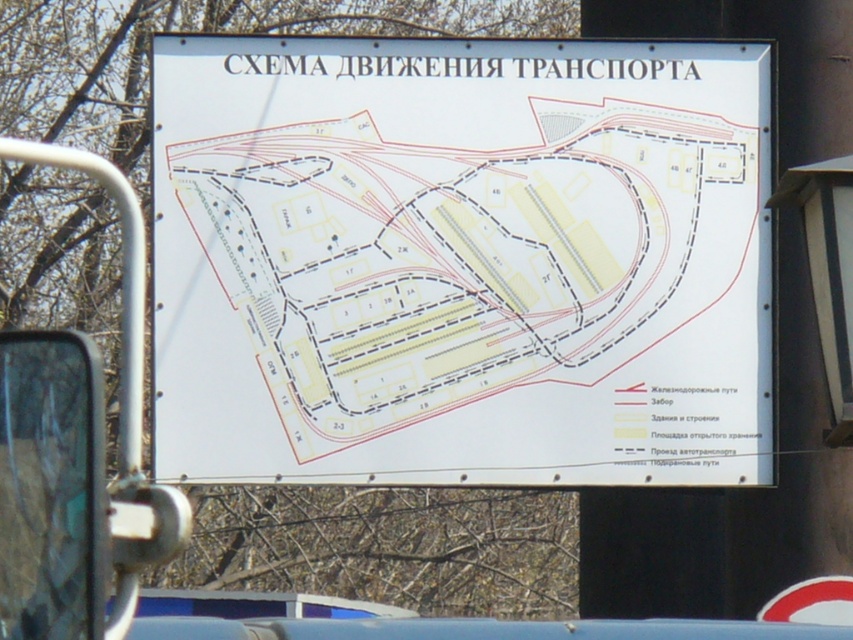
You are a traveler at the station looking at the signboard. Which of the two signs, the white paper sign at center or the white plastic sign at upper center, is shorter?

The white paper sign at center is shorter than the white plastic sign at upper center.

You are a traveler at the railway station looking at the signboard. You notice two signs on the board. Which one is closer to you, the white paper sign at center or the white plastic sign at upper center?

The white paper sign at center is closer to you because it is in front of the white plastic sign at upper center.

You are standing in front of the signboard at the station. You need to read both the white paper sign at center and the white plastic sign at upper center. How far apart are these two signs?

The white paper sign at center is 3.99 feet away from the white plastic sign at upper center.